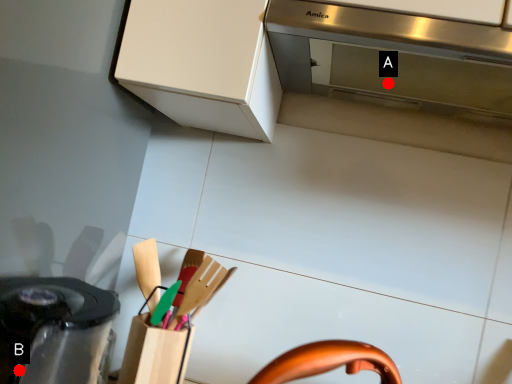
Question: Two points are circled on the image, labeled by A and B beside each circle. Which of the following is the closest to the observer?

Choices:
 (A) A is closer
 (B) B is closer

Answer: (B)